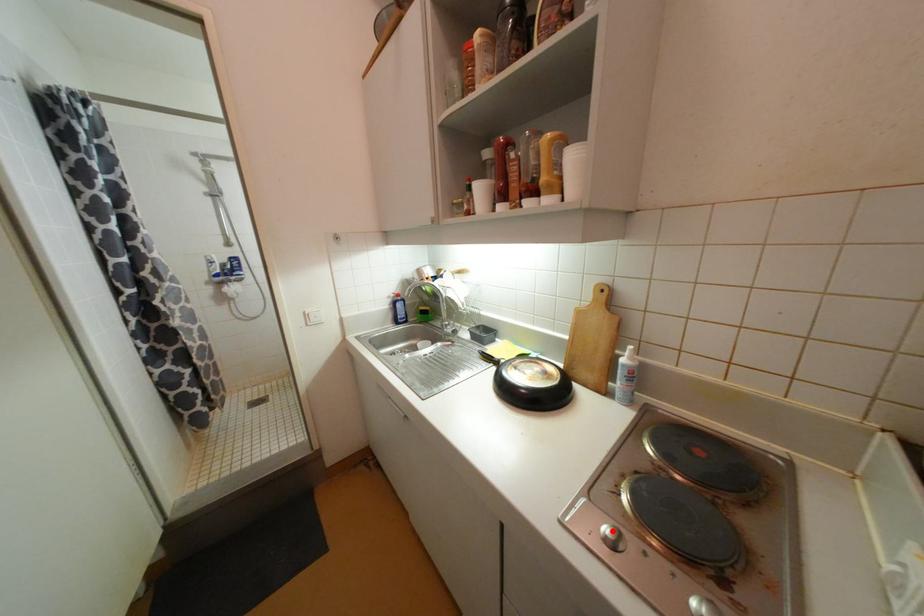
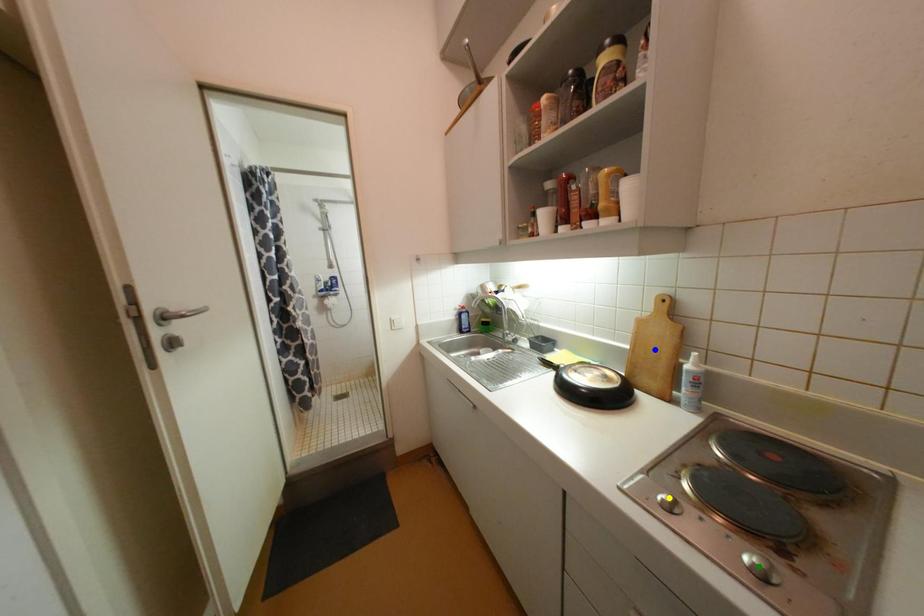
Question: I am providing you with two images of the same scene from different viewpoints. A red point is marked on the first image. You are given multiple points on the second image. Which point in image 2 represents the same 3d spot as the red point in image 1?

Choices:
 (A) green point
 (B) yellow point
 (C) blue point

Answer: (B)